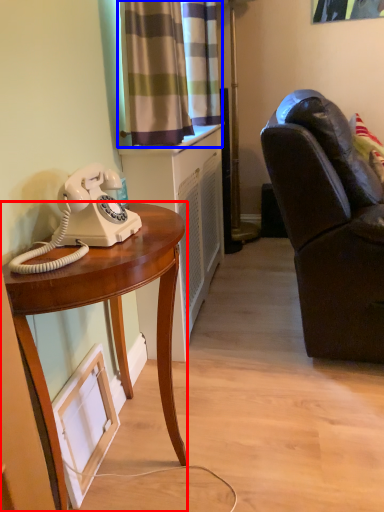
Question: Which object is further to the camera taking this photo, desk (highlighted by a red box) or curtain (highlighted by a blue box)?

Choices:
 (A) desk
 (B) curtain

Answer: (B)